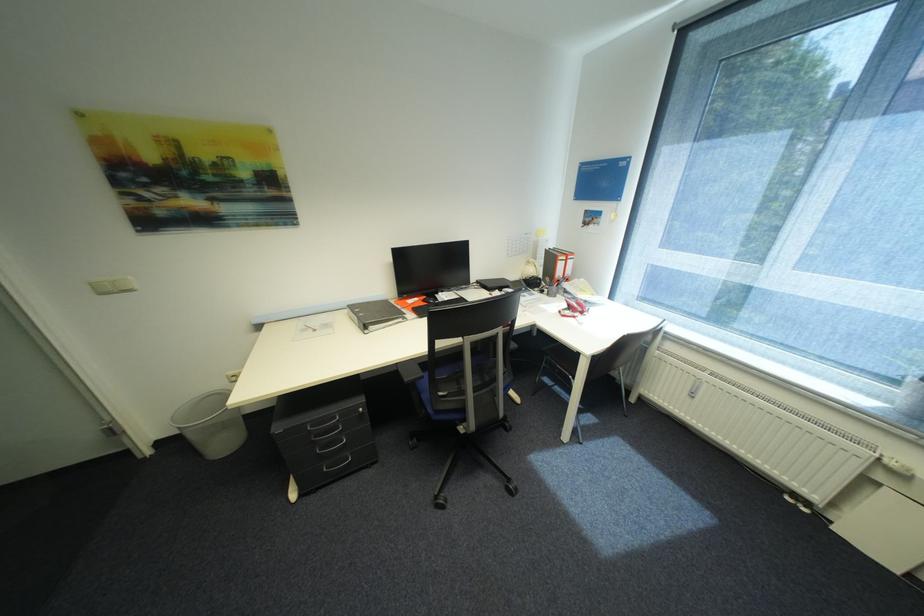
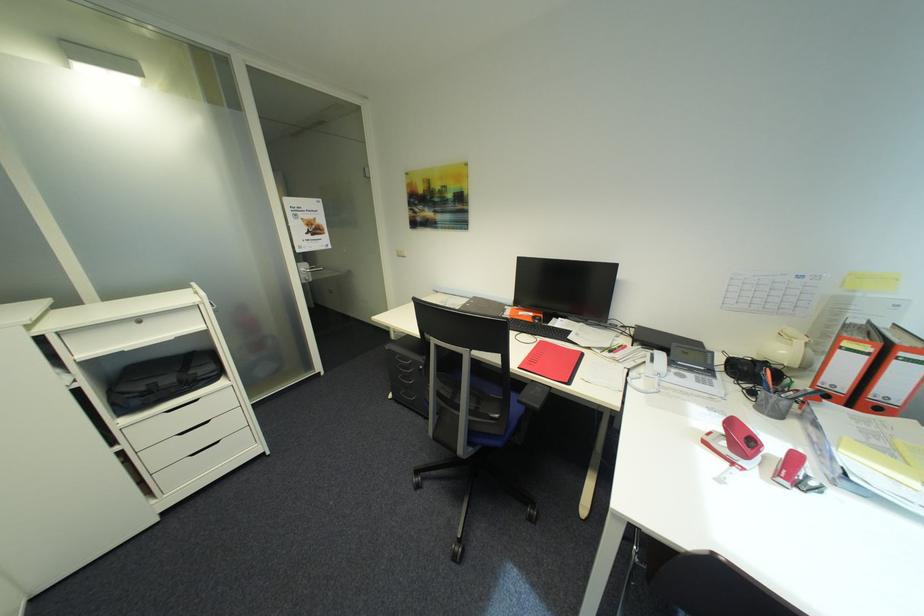
The point at (578, 264) is marked in the first image. Where is the corresponding point in the second image?

(912, 371)